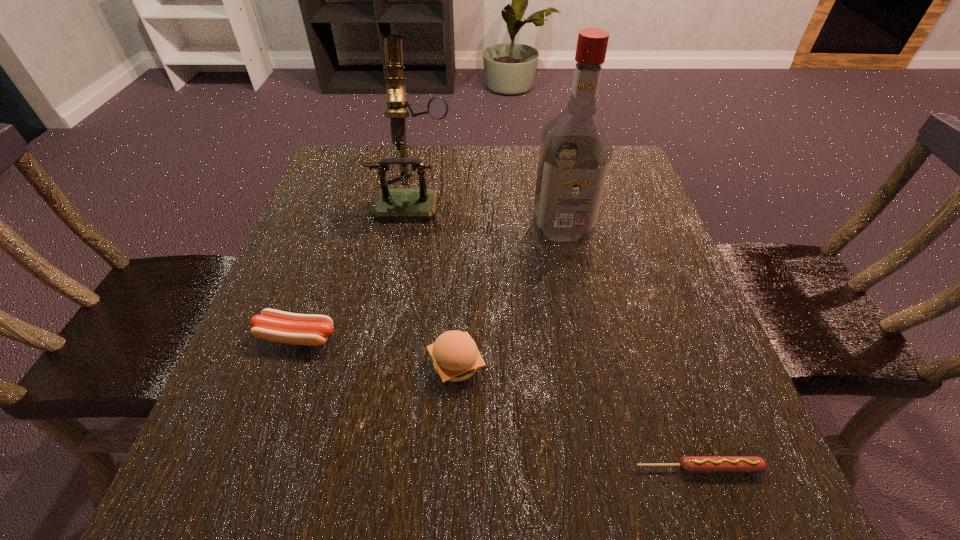
Find the location of a particular element. free area in between the third tallest object and the fourth shortest object is located at coordinates (435, 281).

At what (x,y) coordinates should I click in order to perform the action: click on vacant space that is in between the taller sausage and the liquor. Please return your answer as a coordinate pair (x, y). Looking at the image, I should click on (429, 283).

Identify the location of vacant area that lies between the hamburger and the liquor. This screenshot has height=540, width=960. (509, 297).

This screenshot has width=960, height=540. In order to click on empty space between the hamburger and the shortest object in this screenshot , I will do `click(577, 416)`.

Find the location of `empty space between the left sausage and the hamburger`. empty space between the left sausage and the hamburger is located at coordinates (376, 350).

Locate an element on the screen. The width and height of the screenshot is (960, 540). vacant area that lies between the fourth shortest object and the liquor is located at coordinates (488, 214).

You are a GUI agent. You are given a task and a screenshot of the screen. Output one action in this format:
    pyautogui.click(x=<x>, y=<y>)
    Task: Click on the vacant area between the farther sausage and the liquor
    This screenshot has width=960, height=540.
    Given the screenshot: What is the action you would take?
    pyautogui.click(x=429, y=283)

Select which object is the second closest to the farther sausage. Please provide its 2D coordinates. Your answer should be formatted as a tuple, i.e. [(x, y)], where the tuple contains the x and y coordinates of a point satisfying the conditions above.

[(391, 204)]

Locate which object is the third closest to the second tallest object. Please provide its 2D coordinates. Your answer should be formatted as a tuple, i.e. [(x, y)], where the tuple contains the x and y coordinates of a point satisfying the conditions above.

[(455, 355)]

Identify the location of free point that satisfies the following two spatial constraints: 1. at the eyepiece of the right sausage; 2. on the left side of the second tallest object. The width and height of the screenshot is (960, 540). (368, 468).